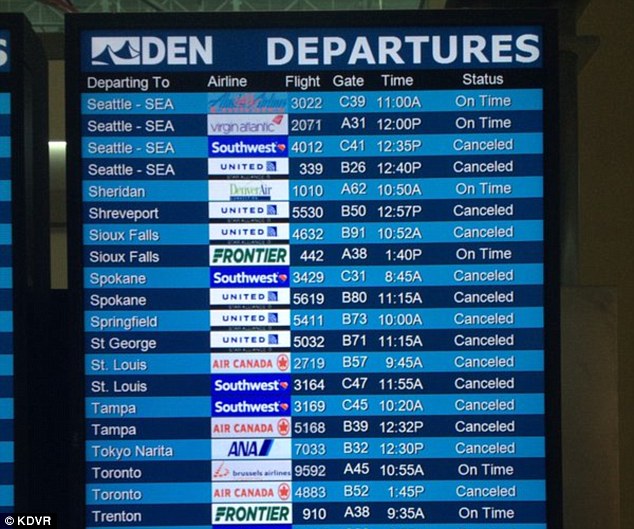
Identify the location of empty wall space. (598, 230).